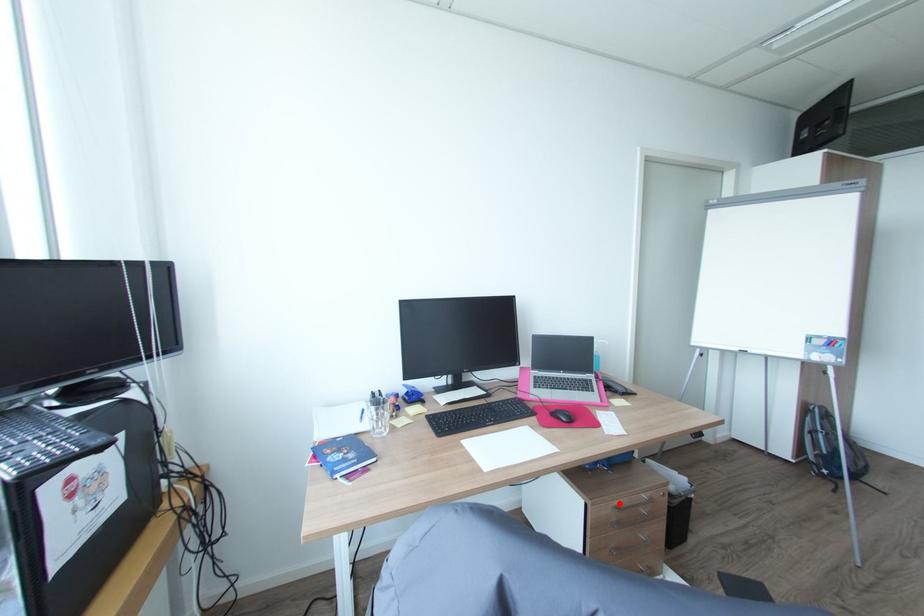
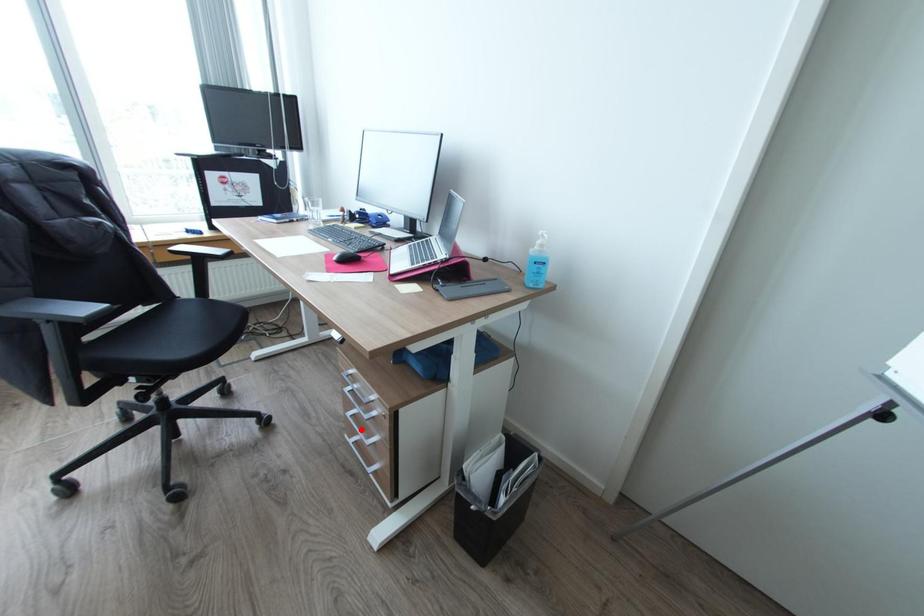
I am providing you with two images of the same scene from different viewpoints. A red point is marked on the first image and another point is marked on the second image. Is the red point in image1 aligned with the point shown in image2?

No